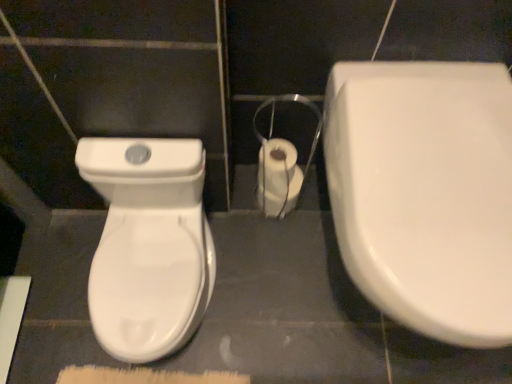
Question: Considering the relative positions of white glossy toilet at left, which is counted as the 2th toilet, starting from the right, and white glossy toilet at right, the first toilet positioned from the right, in the image provided, is white glossy toilet at left, which is counted as the 2th toilet, starting from the right, to the left or to the right of white glossy toilet at right, the first toilet positioned from the right,?

Choices:
 (A) left
 (B) right

Answer: (A)

Question: Considering the positions of point (188, 294) and point (454, 69), is point (188, 294) closer or farther from the camera than point (454, 69)?

Choices:
 (A) farther
 (B) closer

Answer: (A)

Question: Considering the real-world distances, which object is farthest from the white glossy toilet at right, which appears as the 2th toilet when viewed from the left?

Choices:
 (A) white glossy toilet paper at center
 (B) white glossy toilet at left, which is counted as the 2th toilet, starting from the right

Answer: (B)

Question: Based on their relative distances, which object is farther from the white glossy toilet at left, which is counted as the 2th toilet, starting from the right?

Choices:
 (A) white glossy toilet paper at center
 (B) white glossy toilet at right, the first toilet positioned from the right

Answer: (B)